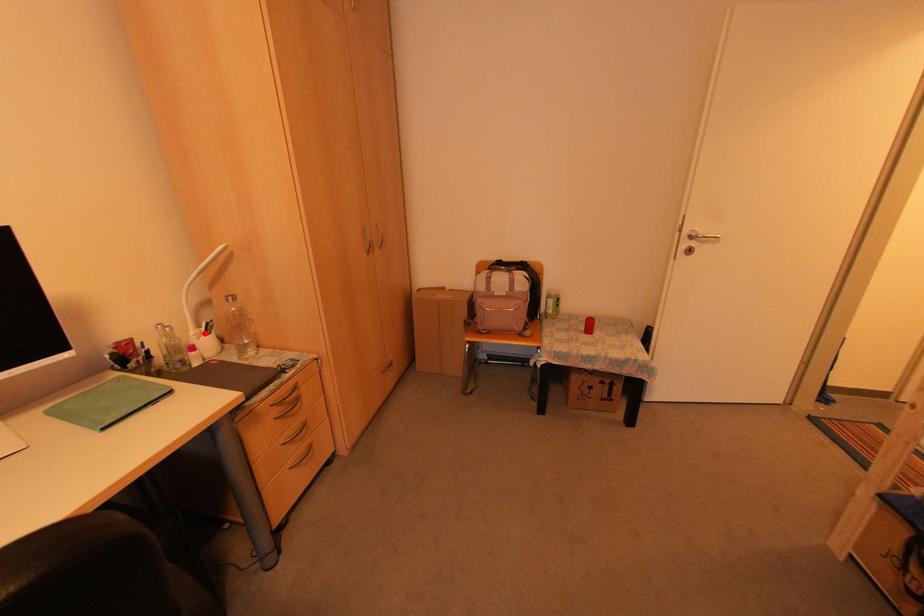
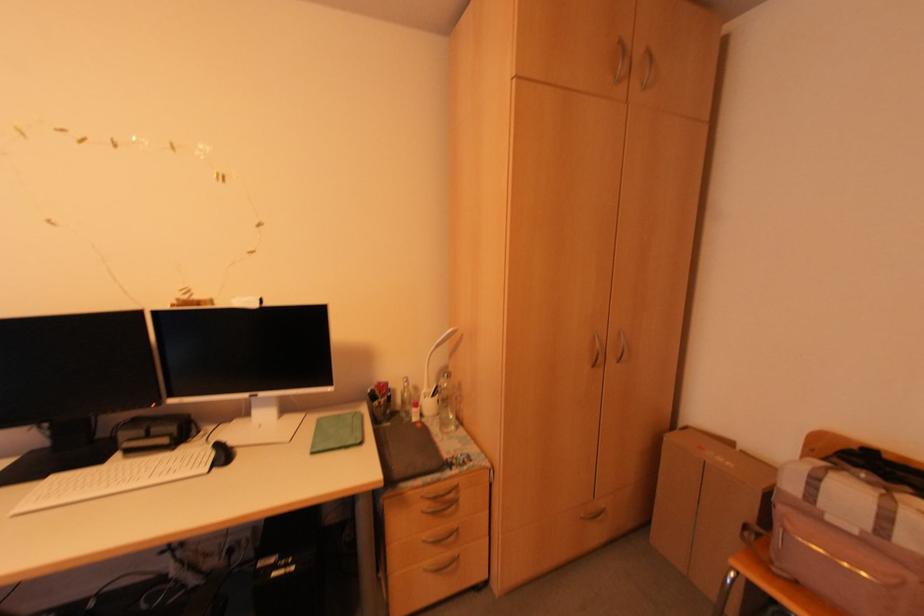
Find the pixel in the second image that matches the highlighted location in the first image.

(431, 395)